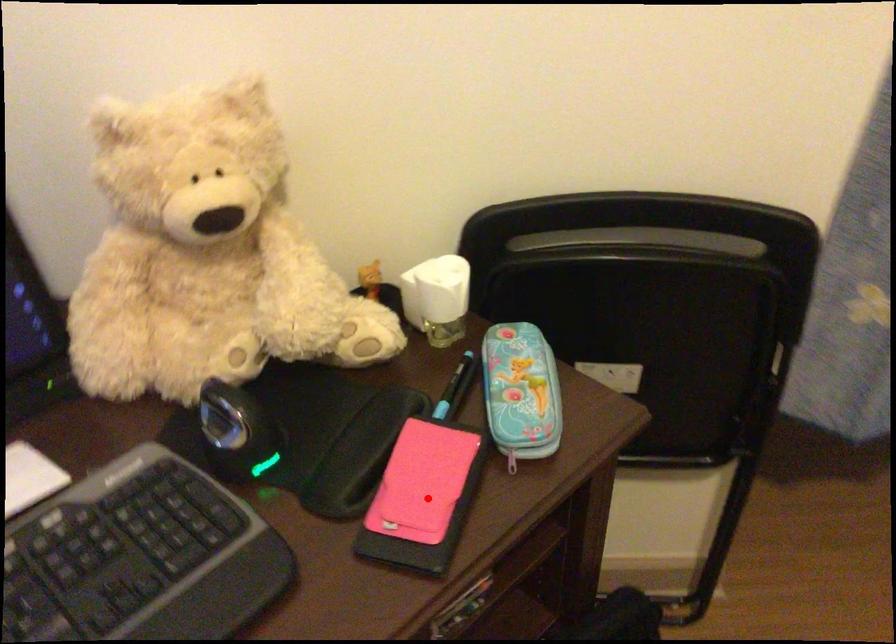
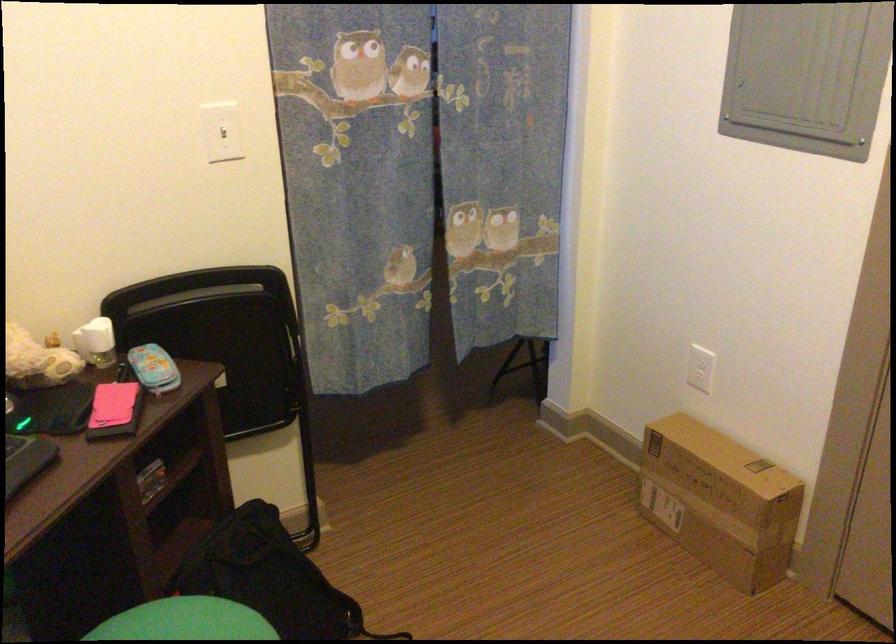
In the second image, find the point that corresponds to the highlighted location in the first image.

(114, 410)